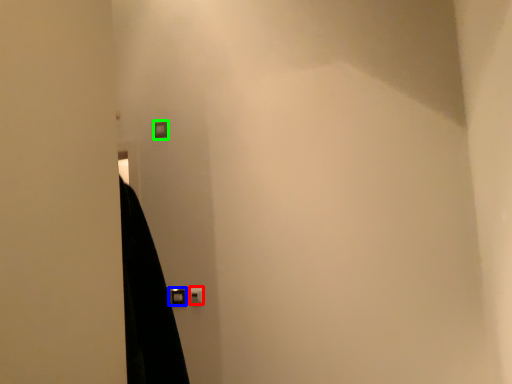
Question: Estimate the real-world distances between objects in this image. Which object is farther from light switch (highlighted by a red box), door handle (highlighted by a blue box) or light switch (highlighted by a green box)?

Choices:
 (A) door handle
 (B) light switch

Answer: (B)